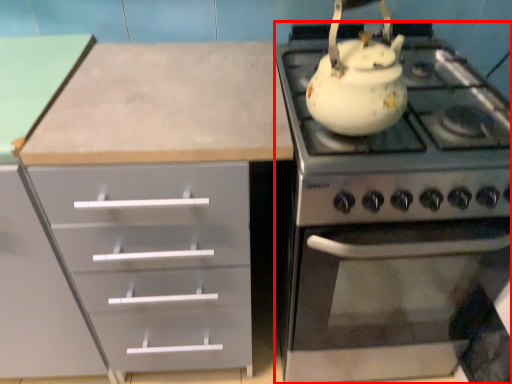
Question: Observing the image, what is the correct spatial positioning of appliance (annotated by the red box) in reference to kettle?

Choices:
 (A) left
 (B) right

Answer: (B)